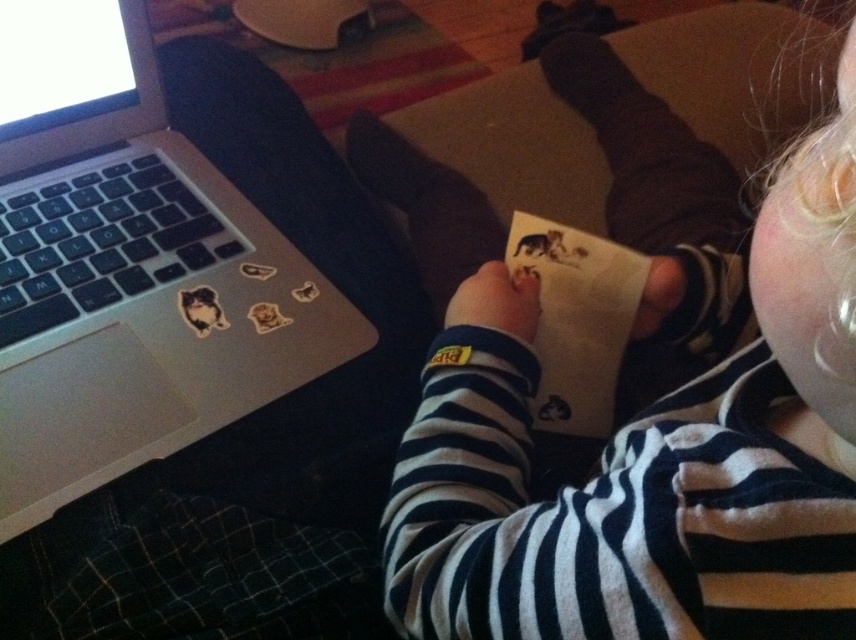
You are a delivery robot with a package that is 10 inches wide. You need to place it between the silver metallic laptop at left and the white paper at center. Is there enough space?

The distance between the silver metallic laptop at left and the white paper at center is 9.98 inches. Since the package is 10 inches wide, there is not enough space to place it between them.

From the picture: You are a delivery robot that needs to place a small package on the white paper at center without touching the silver metallic laptop at left. Is this possible?

The silver metallic laptop at left is positioned over white paper at center, so the white paper at center is covered by the laptop. Therefore, it is not possible to place the package on the white paper at center without moving the laptop.